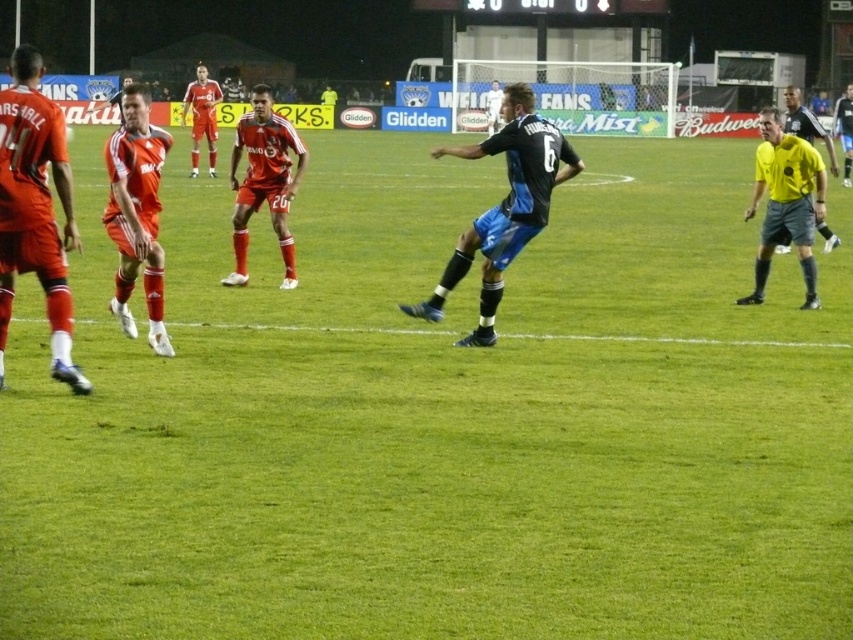
What do you see at coordinates (137, 228) in the screenshot?
I see `matte red shorts at left` at bounding box center [137, 228].

Between matte red shorts at left and yellow jersey at right, which one has more height?

matte red shorts at left

At what (x,y) coordinates should I click in order to perform the action: click on matte red shorts at left. Please return your answer as a coordinate pair (x, y). This screenshot has height=640, width=853. Looking at the image, I should click on (137, 228).

Identify the location of matte red shorts at left. The width and height of the screenshot is (853, 640). (137, 228).

In the scene shown: Between matte red soccer uniform at left and yellow jersey at right, which one has less height?

With less height is yellow jersey at right.

Between matte red soccer uniform at left and yellow jersey at right, which one is positioned lower?

yellow jersey at right

Is point (33, 161) closer to viewer compared to point (776, 177)?

Yes, it is.

Identify the location of matte red soccer uniform at left. (35, 209).

Is point (62, 157) less distant than point (816, 120)?

Yes, it is in front of point (816, 120).

Who is more distant from viewer, [44,230] or [817,125]?

The point [817,125] is behind.

Locate an element on the screen. matte red soccer uniform at left is located at coordinates (35, 209).